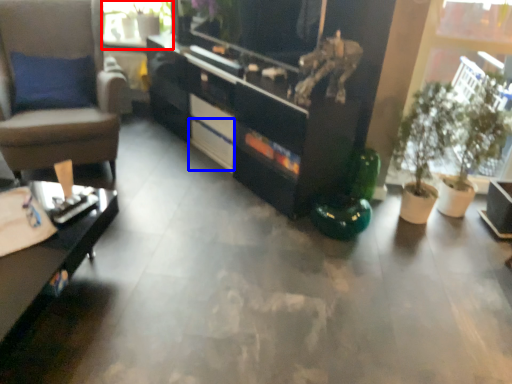
Question: Which object appears farthest to the camera in this image, window screen (highlighted by a red box) or drawer (highlighted by a blue box)?

Choices:
 (A) window screen
 (B) drawer

Answer: (A)